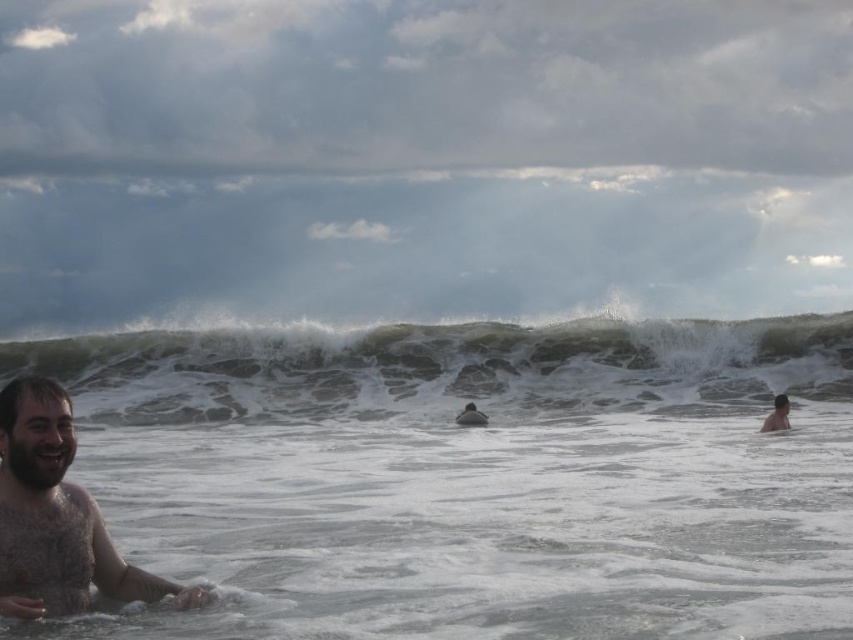
You are a photographer trying to capture a photo of the skinny white man at lower right and the brown leather surfboard at center. Based on their sizes, which one would appear closer to the camera in the photo?

→ The skinny white man at lower right is smaller in size compared to the brown leather surfboard at center, so he would appear closer to the camera in the photo.

You are a photographer standing on the beach and want to take a photo of the skinny white man at lower right and the brown leather surfboard at center. Which object is positioned closer to you?

The skinny white man at lower right is closer to the viewer than the brown leather surfboard at center.

You are a photographer trying to capture the bearded wet man at left and the white frothy water at lower left in the same frame. Based on their positions, which object is closer to the center of the image?

The white frothy water at lower left is closer to the center of the image because it is positioned to the right of the bearded wet man at left, meaning it is nearer to the center compared to the man who is further to the left.